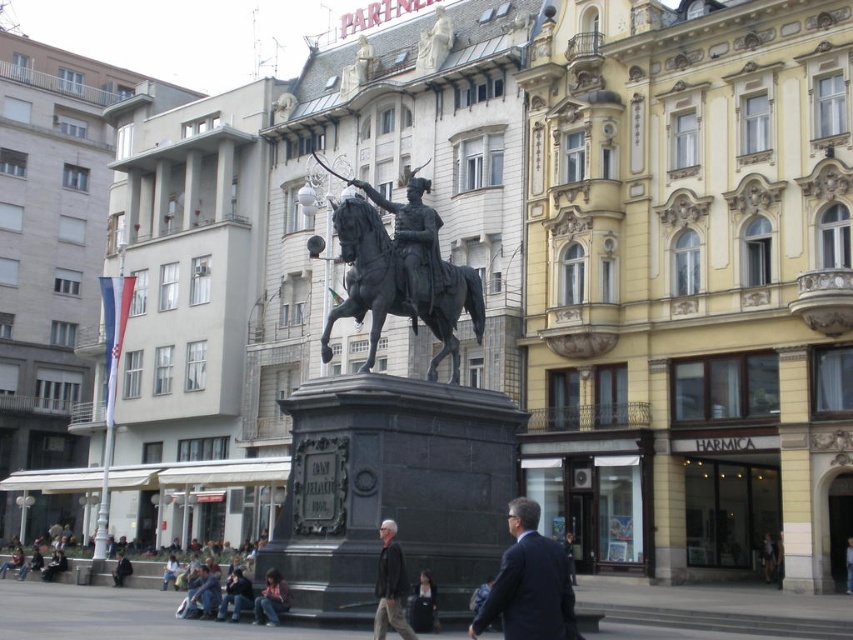
Question: Is bronze statue at center to the left of dark gray jacket at center from the viewer's perspective?

Choices:
 (A) no
 (B) yes

Answer: (A)

Question: Estimate the real-world distances between objects in this image. Which object is farther from the denim jacket at lower center?

Choices:
 (A) dark gray suit at center
 (B) polished bronze horse at center
 (C) dark gray jacket at center
 (D) bronze statue at center

Answer: (D)

Question: Does bronze statue at center appear over denim jacket at lower center?

Choices:
 (A) no
 (B) yes

Answer: (B)

Question: Which object appears farthest from the camera in this image?

Choices:
 (A) bronze statue at center
 (B) polished bronze horse at center
 (C) dark gray suit at center

Answer: (A)

Question: Where is dark gray suit at center located in relation to dark gray jacket at center in the image?

Choices:
 (A) left
 (B) right

Answer: (B)

Question: Which object is closer to the camera taking this photo?

Choices:
 (A) polished bronze horse at center
 (B) bronze statue at center
 (C) dark gray suit at center

Answer: (C)